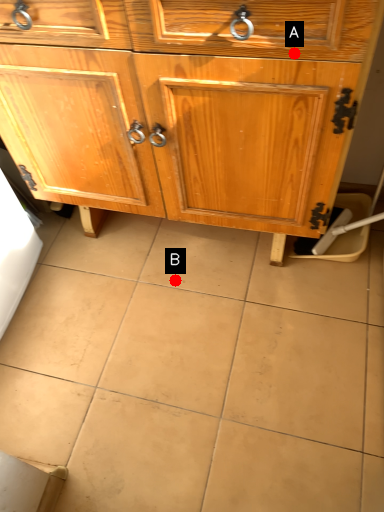
Question: Two points are circled on the image, labeled by A and B beside each circle. Among these points, which one is farthest from the camera?

Choices:
 (A) A is further
 (B) B is further

Answer: (B)